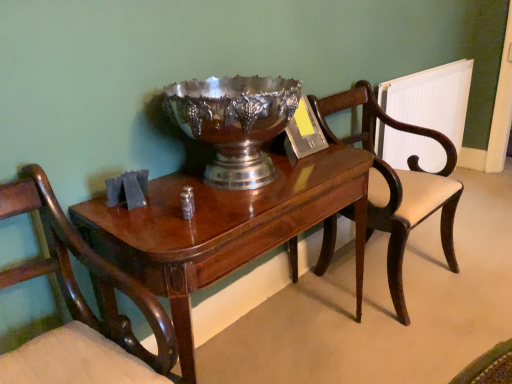
Question: Should I look upward or downward to see mahogany wood chair at left, the 2th chair positioned from the back?

Choices:
 (A) down
 (B) up

Answer: (A)

Question: Can you confirm if mahogany wood chair at right, marked as the 2th chair in a front-to-back arrangement, is wider than mahogany wood chair at left, positioned as the 1th chair in front-to-back order?

Choices:
 (A) no
 (B) yes

Answer: (B)

Question: From the image's perspective, is mahogany wood chair at right, which is the 1th chair in right-to-left order, located beneath mahogany wood chair at left, the 2th chair positioned from the back?

Choices:
 (A) yes
 (B) no

Answer: (B)

Question: Could mahogany wood chair at left, which is the 2th chair from right to left, be considered to be inside mahogany wood chair at right, which is the 1th chair in right-to-left order?

Choices:
 (A) no
 (B) yes

Answer: (A)

Question: Is there a large distance between mahogany wood chair at right, arranged as the second chair when viewed from the left, and mahogany wood chair at left, which is the 2th chair from right to left?

Choices:
 (A) no
 (B) yes

Answer: (B)

Question: Is mahogany wood chair at right, marked as the 2th chair in a front-to-back arrangement, at the left side of mahogany wood chair at left, which is the 1th chair in left-to-right order?

Choices:
 (A) yes
 (B) no

Answer: (B)

Question: Does mahogany wood chair at right, arranged as the second chair when viewed from the left, have a larger size compared to mahogany wood chair at left, the 2th chair positioned from the back?

Choices:
 (A) yes
 (B) no

Answer: (A)

Question: From a real-world perspective, is white plastic radiator at right positioned over mahogany wood chair at left, the 2th chair positioned from the back, based on gravity?

Choices:
 (A) no
 (B) yes

Answer: (A)

Question: Does white plastic radiator at right have a lesser height compared to mahogany wood chair at left, the 2th chair positioned from the back?

Choices:
 (A) yes
 (B) no

Answer: (B)

Question: Does white plastic radiator at right appear on the right side of mahogany wood chair at left, which is the 1th chair in left-to-right order?

Choices:
 (A) yes
 (B) no

Answer: (A)

Question: Is white plastic radiator at right at the left side of mahogany wood chair at left, which is the 2th chair from right to left?

Choices:
 (A) no
 (B) yes

Answer: (A)

Question: Is white plastic radiator at right behind mahogany wood chair at left, which is the 2th chair from right to left?

Choices:
 (A) no
 (B) yes

Answer: (B)

Question: Is white plastic radiator at right directly adjacent to mahogany wood chair at left, which is the 2th chair from right to left?

Choices:
 (A) no
 (B) yes

Answer: (A)

Question: Would you say mahogany wood chair at left, which is the 2th chair from right to left, is part of mahogany wood table at center's contents?

Choices:
 (A) yes
 (B) no

Answer: (B)